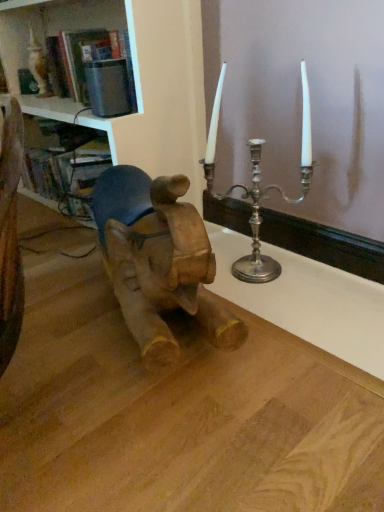
Where is `free space to the right of wooden baby elephant at left`? free space to the right of wooden baby elephant at left is located at coordinates (298, 323).